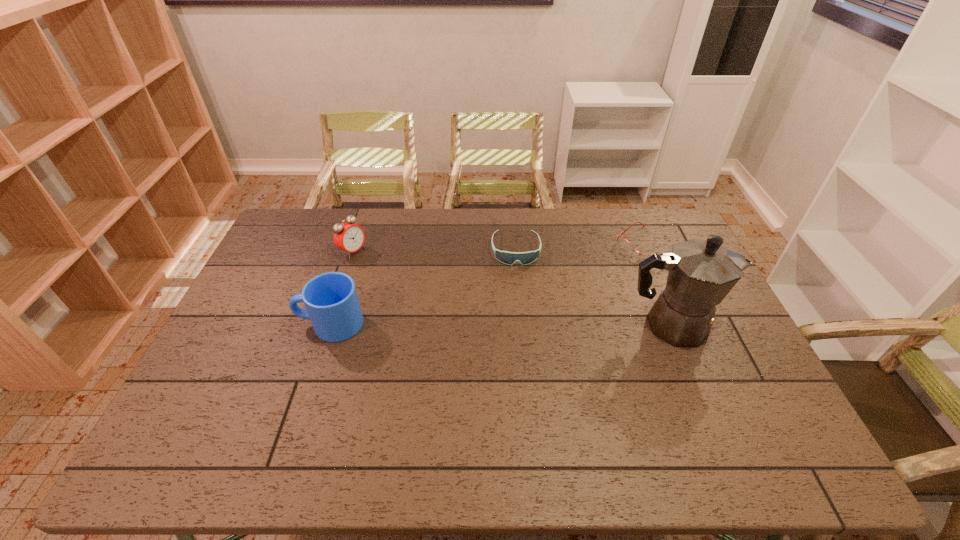
Identify the location of empty space that is in between the spectacles and the alarm clock. (x=501, y=249).

This screenshot has width=960, height=540. In order to click on blank region between the alarm clock and the tallest object in this screenshot , I will do coord(512,288).

Locate an element on the screen. free space between the third object from left to right and the shortest object is located at coordinates (583, 248).

At what (x,y) coordinates should I click in order to perform the action: click on vacant space that is in between the mug and the coffeepot. Please return your answer as a coordinate pair (x, y). This screenshot has height=540, width=960. Looking at the image, I should click on (500, 325).

I want to click on free spot between the shortest object and the third object from left to right, so click(x=583, y=248).

Image resolution: width=960 pixels, height=540 pixels. Identify the location of empty space between the mug and the goggles. (423, 287).

Image resolution: width=960 pixels, height=540 pixels. I want to click on free spot between the shortest object and the alarm clock, so click(501, 249).

The width and height of the screenshot is (960, 540). Identify the location of vacant point located between the spectacles and the alarm clock. (501, 249).

Identify the location of vacant area between the spectacles and the coffeepot. (660, 286).

The height and width of the screenshot is (540, 960). Identify the location of vacant area that lies between the spectacles and the mug. (490, 286).